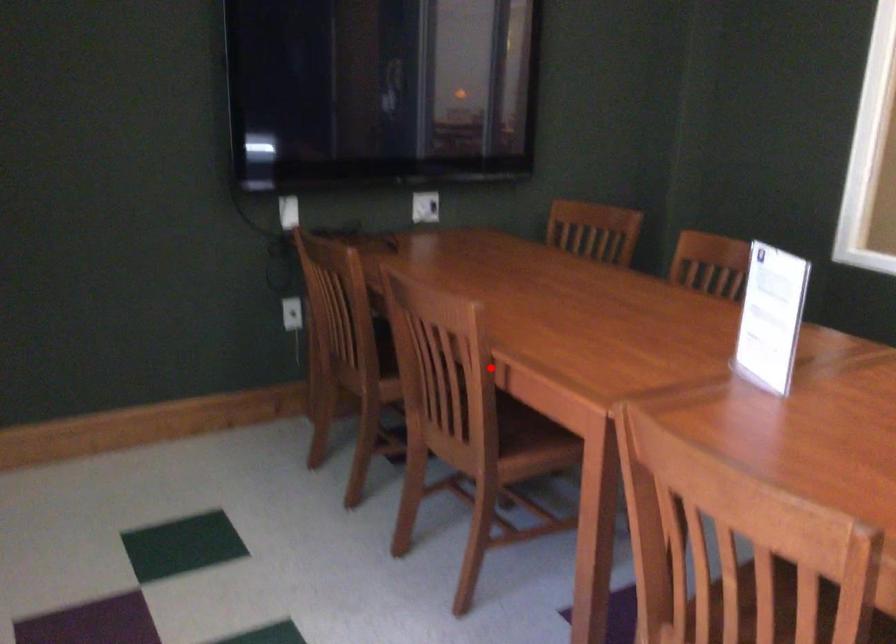
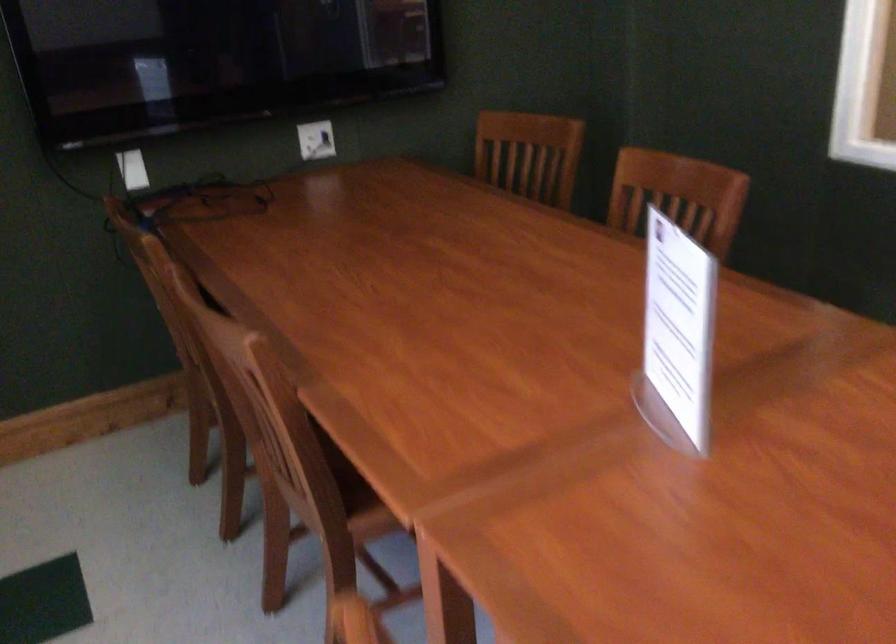
In the second image, find the point that corresponds to the highlighted location in the first image.

(299, 413)